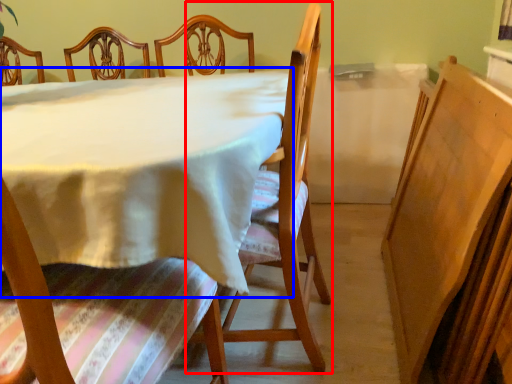
Question: Among these objects, which one is farthest to the camera, chair (highlighted by a red box) or table (highlighted by a blue box)?

Choices:
 (A) chair
 (B) table

Answer: (A)